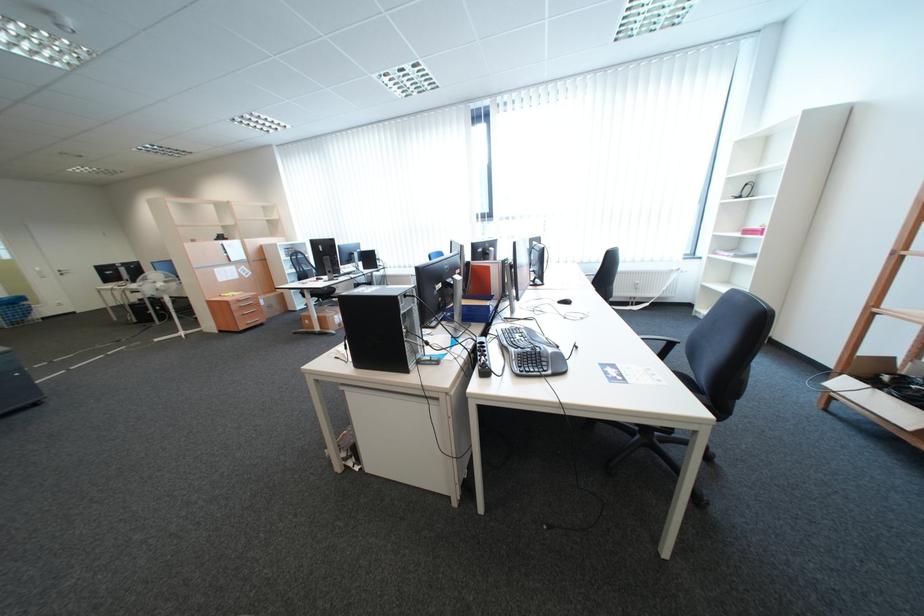
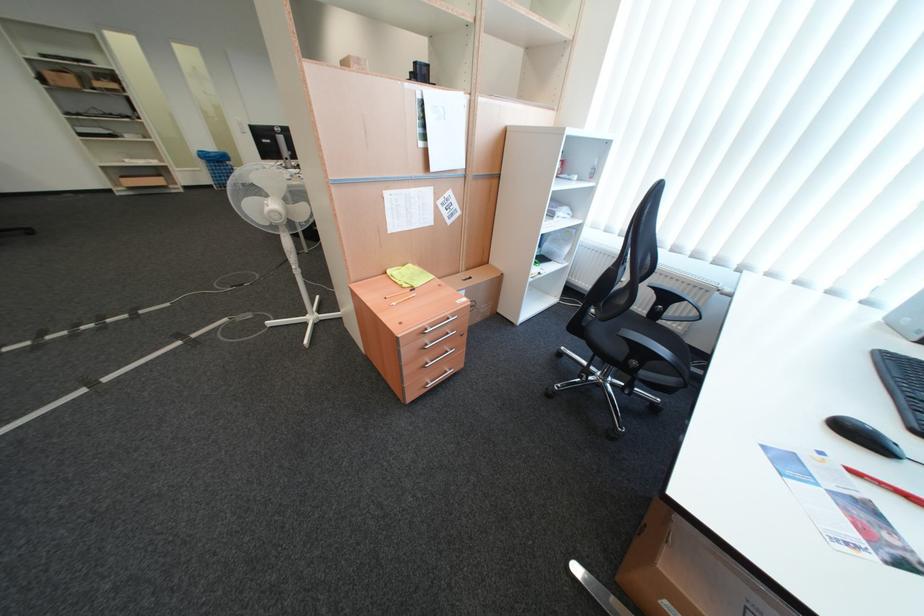
Locate, in the second image, the point that corresponds to (275,296) in the first image.

(479, 272)